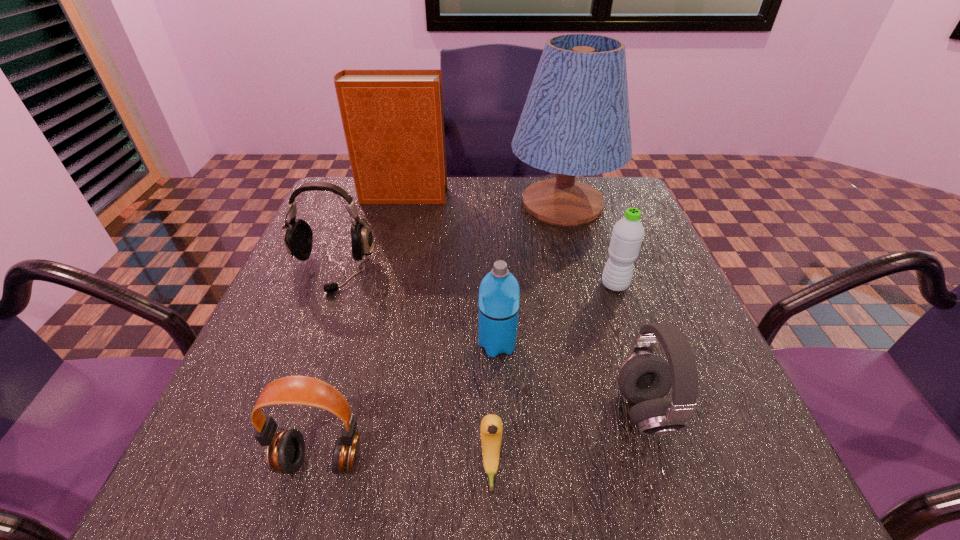
What are the coordinates of `water bottle that is at the right edge` in the screenshot? It's located at (628, 232).

I want to click on headset that is positioned at the right edge, so click(x=644, y=379).

You are a GUI agent. You are given a task and a screenshot of the screen. Output one action in this format:
    pyautogui.click(x=<x>, y=<y>)
    Task: Click on the object that is at the far left corner
    
    Given the screenshot: What is the action you would take?
    pyautogui.click(x=393, y=120)

In order to click on object that is at the near left corner in this screenshot , I will do (285, 450).

This screenshot has width=960, height=540. I want to click on object positioned at the far right corner, so click(575, 122).

Identify the location of object that is at the near right corner. (644, 379).

What are the coordinates of `free region at the far edge of the desktop` in the screenshot? It's located at (481, 218).

The image size is (960, 540). In the image, there is a desktop. What are the coordinates of `vacant space at the near edge` in the screenshot? It's located at (433, 444).

The image size is (960, 540). In order to click on vacant region at the left edge of the desktop in this screenshot , I will do `click(245, 374)`.

You are a GUI agent. You are given a task and a screenshot of the screen. Output one action in this format:
    pyautogui.click(x=<x>, y=<y>)
    Task: Click on the vacant space at the right edge of the desktop
    Image resolution: width=960 pixels, height=540 pixels.
    Given the screenshot: What is the action you would take?
    pyautogui.click(x=603, y=258)